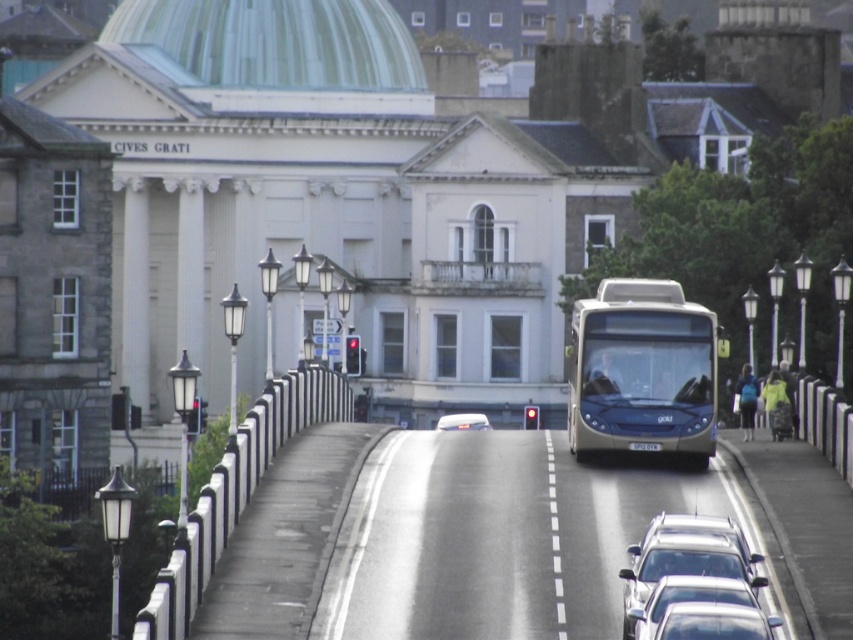
Who is taller, metallic silver car at center or white plastic license plate at center?

With more height is metallic silver car at center.

How distant is metallic silver car at center from white plastic license plate at center?

The distance of metallic silver car at center from white plastic license plate at center is 22.14 meters.

Describe the element at coordinates (462, 420) in the screenshot. I see `metallic silver car at center` at that location.

Where is `metallic silver car at center`? metallic silver car at center is located at coordinates (462, 420).

From the picture: Can you confirm if metallic silver bus at center is wider than silver metallic car at lower center?

Yes.

Is metallic silver bus at center bigger than silver metallic car at lower center?

Yes.

The width and height of the screenshot is (853, 640). I want to click on metallic silver bus at center, so click(x=641, y=371).

You are a GUI agent. You are given a task and a screenshot of the screen. Output one action in this format:
    pyautogui.click(x=<x>, y=<y>)
    Task: Click on the metallic silver bus at center
    
    Given the screenshot: What is the action you would take?
    pyautogui.click(x=641, y=371)

Is metallic silver bus at center shorter than metallic silver car at center?

No, metallic silver bus at center is not shorter than metallic silver car at center.

Can you confirm if metallic silver bus at center is positioned above metallic silver car at center?

Indeed, metallic silver bus at center is positioned over metallic silver car at center.

Is point (608, 321) farther from camera compared to point (462, 419)?

No, (608, 321) is in front of (462, 419).

Where is `metallic silver bus at center`? The image size is (853, 640). metallic silver bus at center is located at coordinates (641, 371).